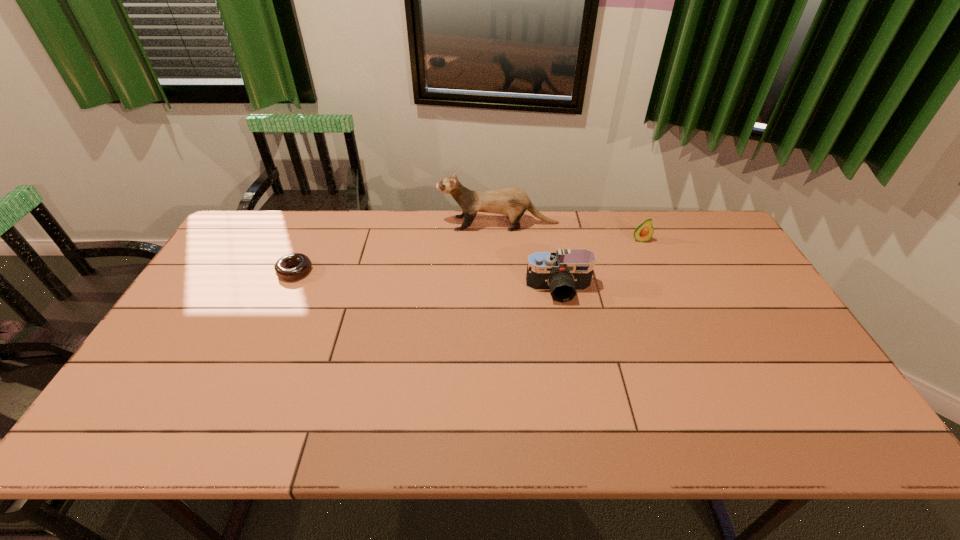
Locate an element on the screen. free space at the near right corner is located at coordinates (811, 436).

This screenshot has width=960, height=540. Identify the location of empty location between the shortest object and the second shortest object. (468, 255).

This screenshot has height=540, width=960. Find the location of `free space between the camera and the rightmost object`. free space between the camera and the rightmost object is located at coordinates (599, 265).

I want to click on free space between the doughnut and the tallest object, so pyautogui.click(x=396, y=247).

The width and height of the screenshot is (960, 540). I want to click on empty location between the doughnut and the third shortest object, so click(427, 281).

Find the location of `vacant area that lies between the camera and the avocado`. vacant area that lies between the camera and the avocado is located at coordinates (599, 265).

I want to click on blank region between the doughnut and the second farthest object, so click(468, 255).

Identify the location of vacant region between the camera and the leftmost object. (427, 281).

The width and height of the screenshot is (960, 540). I want to click on empty space that is in between the camera and the leftmost object, so click(427, 281).

Where is `empty space that is in between the third nearest object and the doughnut`? This screenshot has width=960, height=540. empty space that is in between the third nearest object and the doughnut is located at coordinates (468, 255).